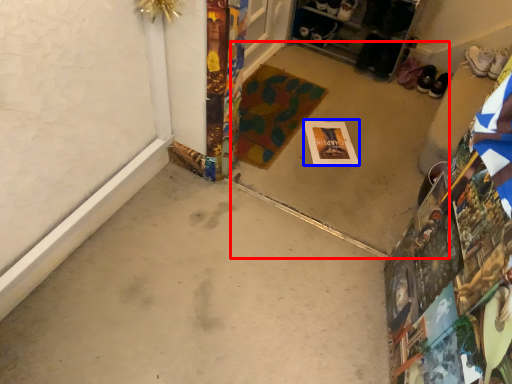
Question: Which object is closer to the camera taking this photo, concrete (highlighted by a red box) or postcard (highlighted by a blue box)?

Choices:
 (A) concrete
 (B) postcard

Answer: (A)